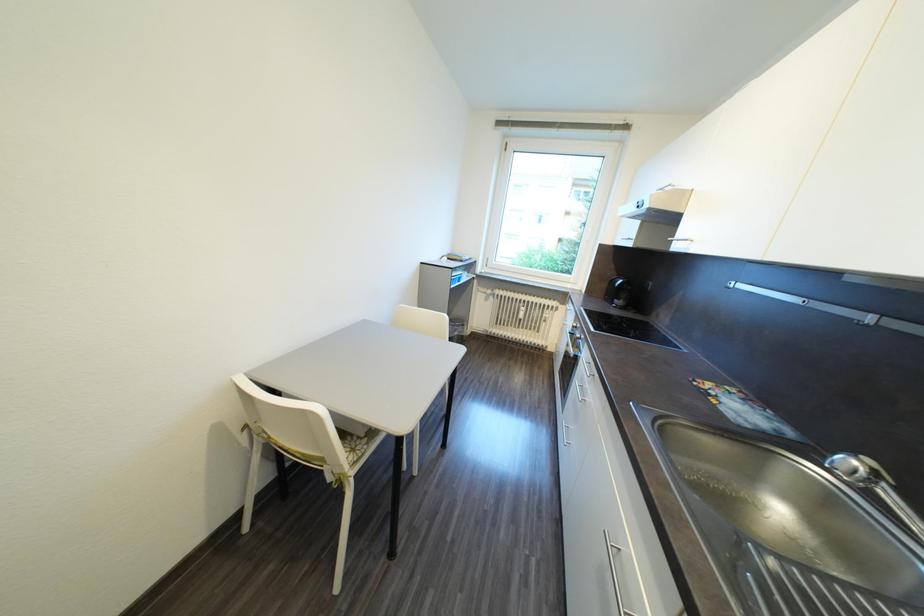
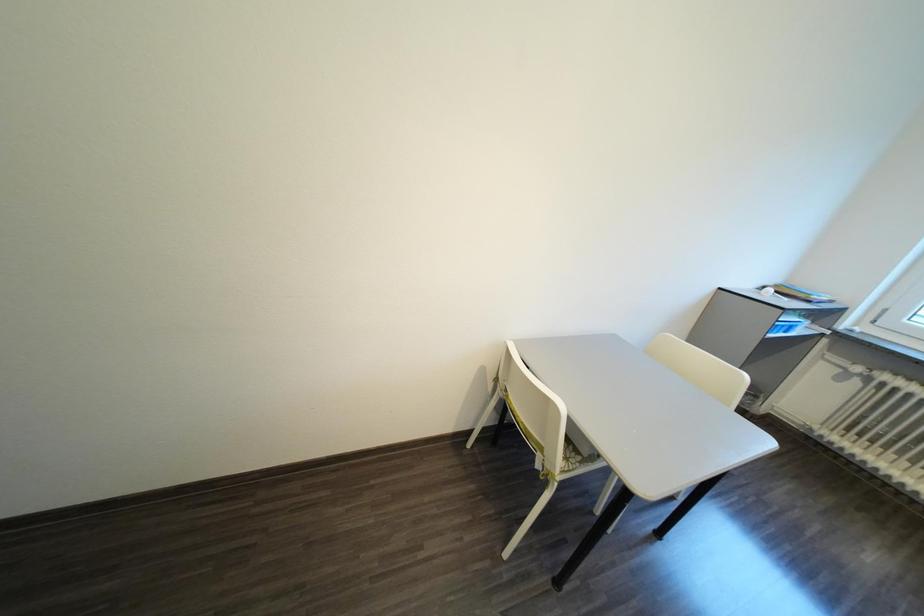
Question: The camera is either moving clockwise (left) or counter-clockwise (right) around the object. The first image is from the beginning of the video and the second image is from the end. Is the camera moving left or right when shooting the video?

Choices:
 (A) Left
 (B) Right

Answer: (B)